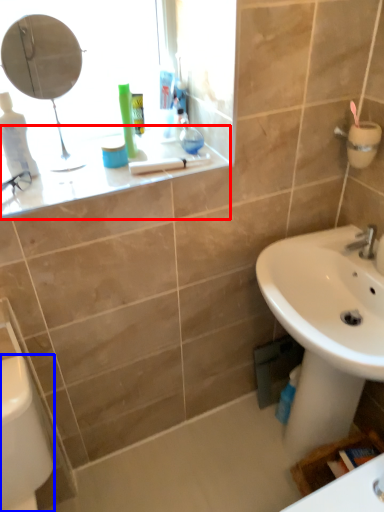
Question: Which of the following is the closest to the observer, counter top (highlighted by a red box) or porcelain (highlighted by a blue box)?

Choices:
 (A) counter top
 (B) porcelain

Answer: (B)